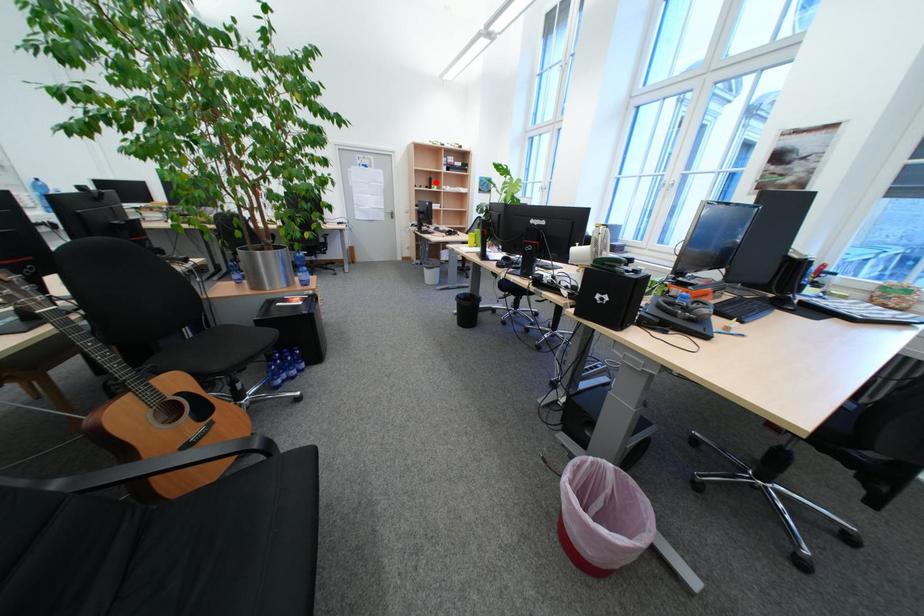
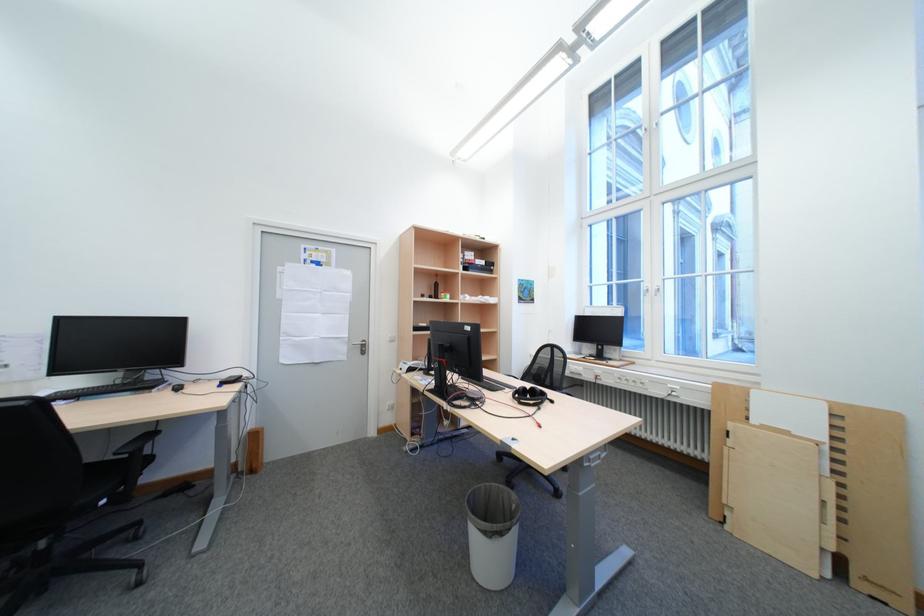
The point at the highlighted location is marked in the first image. Where is the corresponding point in the second image?

(436, 290)